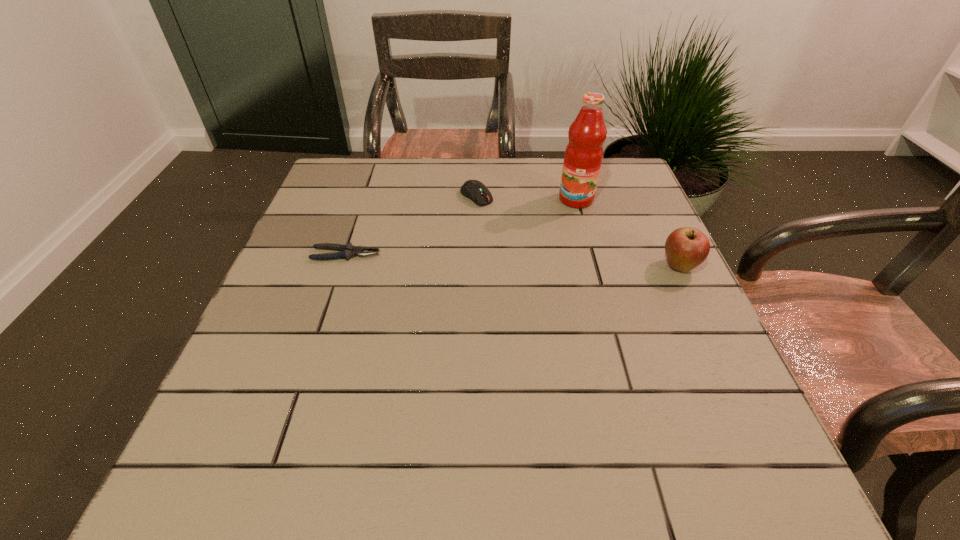
What are the coordinates of `the second closest object to the fruit juice` in the screenshot? It's located at pos(686,248).

Locate an element on the screen. Image resolution: width=960 pixels, height=540 pixels. object that is the closest to the fruit juice is located at coordinates (475, 190).

Locate an element on the screen. The height and width of the screenshot is (540, 960). vacant region that satisfies the following two spatial constraints: 1. on the front side of the second shortest object; 2. on the left side of the apple is located at coordinates (476, 266).

Where is `free location that satisfies the following two spatial constraints: 1. on the front side of the third shortest object; 2. on the left side of the second shortest object`? free location that satisfies the following two spatial constraints: 1. on the front side of the third shortest object; 2. on the left side of the second shortest object is located at coordinates (476, 266).

Locate an element on the screen. blank area in the image that satisfies the following two spatial constraints: 1. on the front side of the computer equipment; 2. on the right side of the fruit juice is located at coordinates (476, 199).